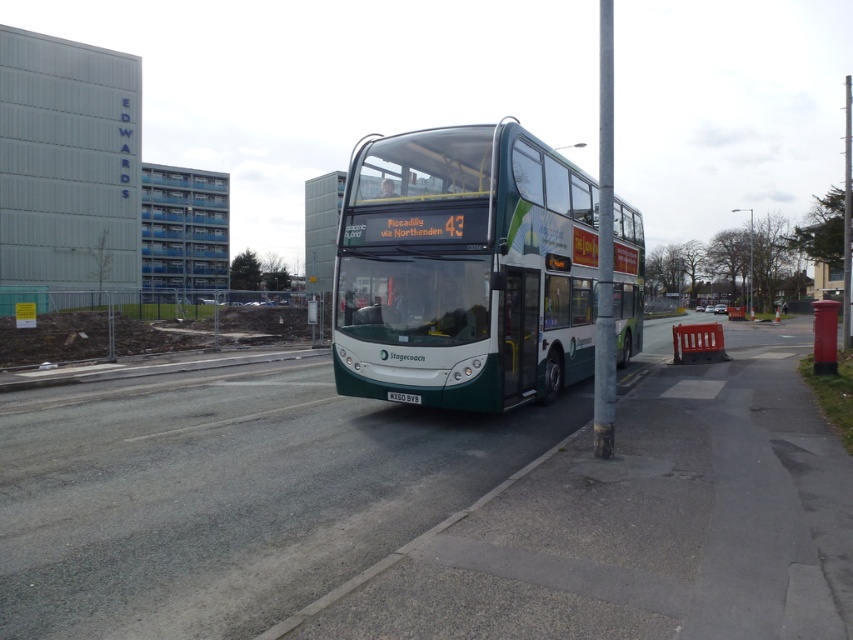
Does point (361, 212) come behind point (397, 394)?

Yes, point (361, 212) is farther from viewer.

Who is taller, green matte/deck bus at center or white plastic license plate at center?

green matte/deck bus at center is taller.

Describe the element at coordinates (463, 269) in the screenshot. The image size is (853, 640). I see `green matte/deck bus at center` at that location.

The image size is (853, 640). In order to click on green matte/deck bus at center in this screenshot , I will do `click(463, 269)`.

Does green matte/deck bus at center appear on the right side of silver metallic pole at right?

In fact, green matte/deck bus at center is to the left of silver metallic pole at right.

Who is lower down, green matte/deck bus at center or silver metallic pole at right?

Positioned lower is green matte/deck bus at center.

Does point (550, 157) come in front of point (599, 445)?

No, it is not.

At what (x,y) coordinates should I click in order to perform the action: click on green matte/deck bus at center. Please return your answer as a coordinate pair (x, y). Looking at the image, I should click on (463, 269).

Which is above, silver metallic pole at right or white plastic license plate at center?

silver metallic pole at right is higher up.

Is point (608, 90) positioned in front of point (395, 396)?

That is False.

You are a GUI agent. You are given a task and a screenshot of the screen. Output one action in this format:
    pyautogui.click(x=<x>, y=<y>)
    Task: Click on the silver metallic pole at right
    Image resolution: width=853 pixels, height=640 pixels.
    Given the screenshot: What is the action you would take?
    pyautogui.click(x=604, y=246)

What are the coordinates of `silver metallic pole at right` in the screenshot? It's located at (604, 246).